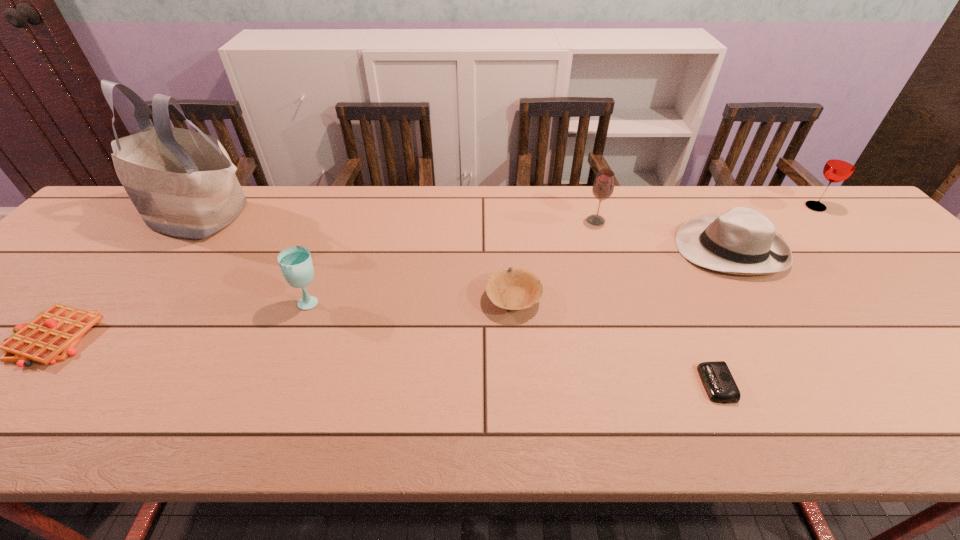
Locate an element on the screen. This screenshot has width=960, height=540. free point located 0.340m on the display of the sixth object from left to right is located at coordinates (532, 384).

This screenshot has height=540, width=960. I want to click on free spot located on the display of the sixth object from left to right, so click(x=642, y=384).

What are the coordinates of `vacant space located on the display of the sixth object from left to right` in the screenshot? It's located at (632, 384).

Image resolution: width=960 pixels, height=540 pixels. What are the coordinates of `shopping bag at the far edge` in the screenshot? It's located at (182, 182).

Identify the location of fedora that is at the far edge. (742, 241).

The height and width of the screenshot is (540, 960). I want to click on object present at the near edge, so point(717,379).

This screenshot has height=540, width=960. I want to click on object positioned at the left edge, so click(182, 182).

Locate an element on the screen. The width and height of the screenshot is (960, 540). object that is at the right edge is located at coordinates (840, 166).

Locate an element on the screen. The height and width of the screenshot is (540, 960). object that is at the far left corner is located at coordinates (182, 182).

What are the coordinates of `object that is at the far right corner` in the screenshot? It's located at (840, 166).